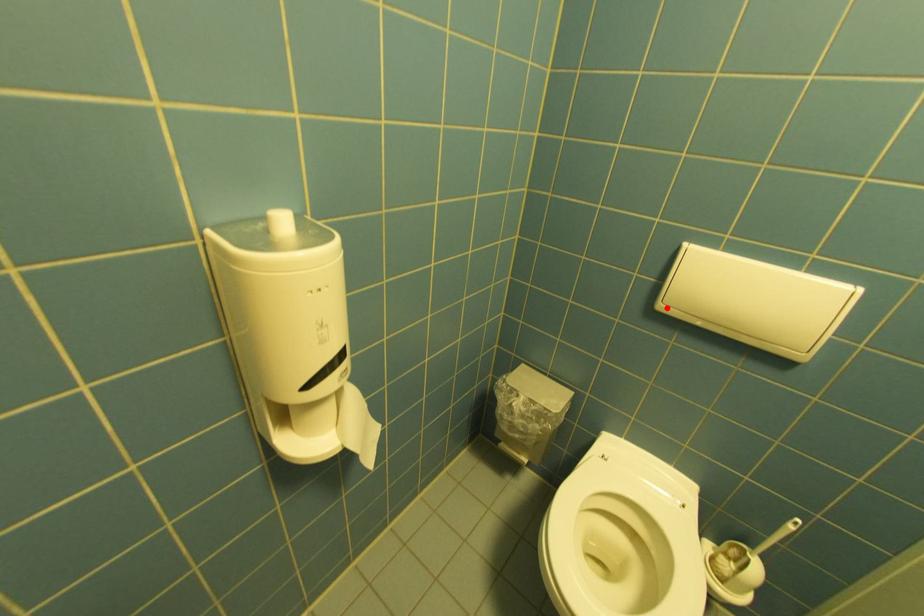
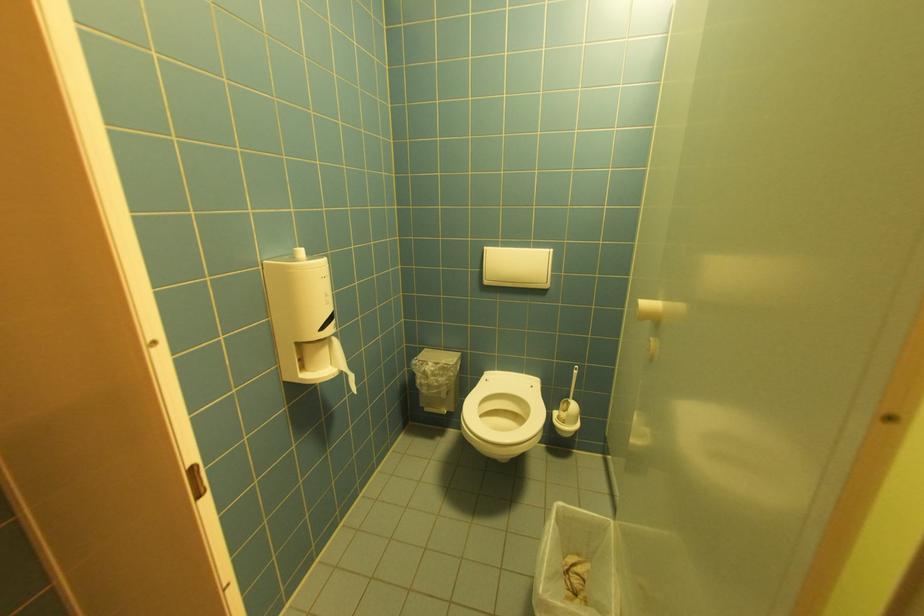
Locate, in the second image, the point that corresponds to the highlighted location in the first image.

(492, 283)